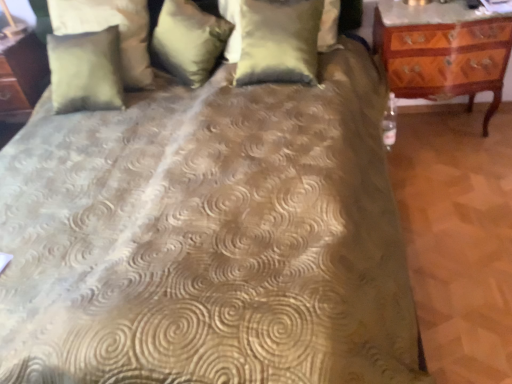
Question: Is satin gold pillow at upper center, which is counted as the 2th pillow, starting from the right, smaller than suede-like beige pillow at upper left, the third pillow when ordered from right to left?

Choices:
 (A) yes
 (B) no

Answer: (B)

Question: Is satin gold pillow at upper center, the second pillow positioned from the left, thinner than suede-like beige pillow at upper left, the third pillow when ordered from right to left?

Choices:
 (A) yes
 (B) no

Answer: (B)

Question: Is satin gold pillow at upper center, which is counted as the 2th pillow, starting from the right, looking in the opposite direction of suede-like beige pillow at upper left, arranged as the first pillow when viewed from the left?

Choices:
 (A) yes
 (B) no

Answer: (B)

Question: Can you confirm if satin gold pillow at upper center, the second pillow positioned from the left, is wider than suede-like beige pillow at upper left, arranged as the first pillow when viewed from the left?

Choices:
 (A) yes
 (B) no

Answer: (A)

Question: From a real-world perspective, is satin gold pillow at upper center, the second pillow positioned from the left, on suede-like beige pillow at upper left, the third pillow when ordered from right to left?

Choices:
 (A) no
 (B) yes

Answer: (A)

Question: Based on their sizes in the image, would you say suede-like beige pillow at upper left, arranged as the first pillow when viewed from the left, is bigger or smaller than satin gold pillow at upper center, the second pillow positioned from the left?

Choices:
 (A) big
 (B) small

Answer: (B)

Question: Is suede-like beige pillow at upper left, arranged as the first pillow when viewed from the left, to the left or to the right of satin gold pillow at upper center, which is counted as the 2th pillow, starting from the right, in the image?

Choices:
 (A) right
 (B) left

Answer: (B)

Question: From a real-world perspective, is suede-like beige pillow at upper left, the third pillow when ordered from right to left, above or below satin gold pillow at upper center, which is counted as the 2th pillow, starting from the right?

Choices:
 (A) below
 (B) above

Answer: (B)

Question: In terms of width, does suede-like beige pillow at upper left, arranged as the first pillow when viewed from the left, look wider or thinner when compared to satin gold pillow at upper center, the second pillow positioned from the left?

Choices:
 (A) wide
 (B) thin

Answer: (B)

Question: In terms of width, does satin gold pillow at upper center, which is counted as the 2th pillow, starting from the right, look wider or thinner when compared to satin gold pillow at center, the third pillow from the left?

Choices:
 (A) wide
 (B) thin

Answer: (A)

Question: From the image's perspective, is satin gold pillow at upper center, which is counted as the 2th pillow, starting from the right, above or below satin gold pillow at center, the third pillow from the left?

Choices:
 (A) below
 (B) above

Answer: (B)

Question: In terms of height, does satin gold pillow at upper center, which is counted as the 2th pillow, starting from the right, look taller or shorter compared to satin gold pillow at center, the third pillow from the left?

Choices:
 (A) tall
 (B) short

Answer: (B)

Question: Is satin gold pillow at upper center, the second pillow positioned from the left, inside or outside of satin gold pillow at center, placed as the first pillow when sorted from right to left?

Choices:
 (A) outside
 (B) inside

Answer: (A)

Question: From their relative heights in the image, would you say wooden carved nightstand at right is taller or shorter than satin gold pillow at upper center, the second pillow positioned from the left?

Choices:
 (A) tall
 (B) short

Answer: (A)

Question: From a real-world perspective, is wooden carved nightstand at right above or below satin gold pillow at upper center, which is counted as the 2th pillow, starting from the right?

Choices:
 (A) below
 (B) above

Answer: (A)